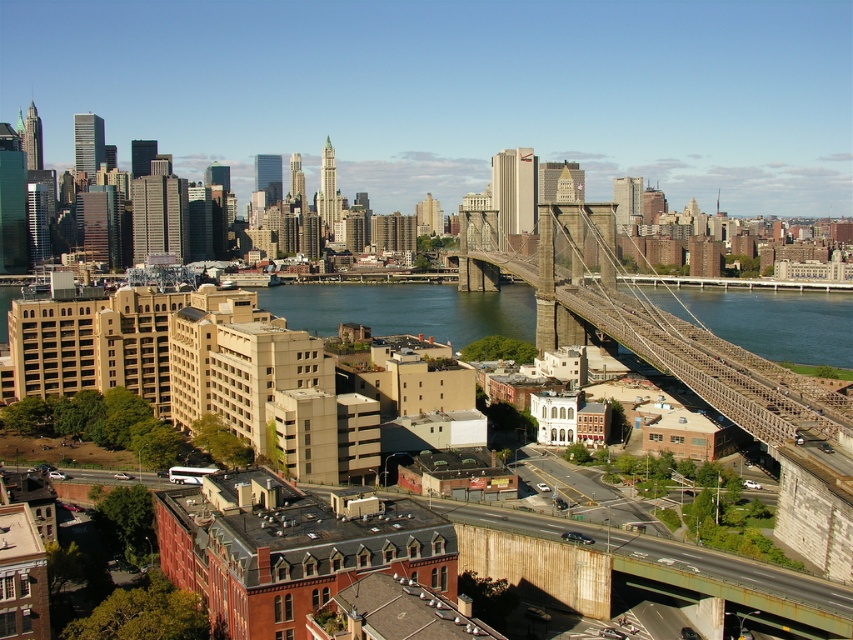
Question: Which point is closer to the camera?

Choices:
 (A) (813, 317)
 (B) (759, 388)

Answer: (B)

Question: Can you confirm if dark gray steel suspension bridge at center is positioned below blue water at center?

Choices:
 (A) yes
 (B) no

Answer: (B)

Question: Is dark gray steel suspension bridge at center positioned behind blue water at center?

Choices:
 (A) no
 (B) yes

Answer: (A)

Question: Among these objects, which one is nearest to the camera?

Choices:
 (A) blue water at center
 (B) dark gray steel suspension bridge at center

Answer: (B)

Question: Can you confirm if dark gray steel suspension bridge at center is positioned above blue water at center?

Choices:
 (A) no
 (B) yes

Answer: (B)

Question: Which object appears closest to the camera in this image?

Choices:
 (A) dark gray steel suspension bridge at center
 (B) blue water at center

Answer: (A)